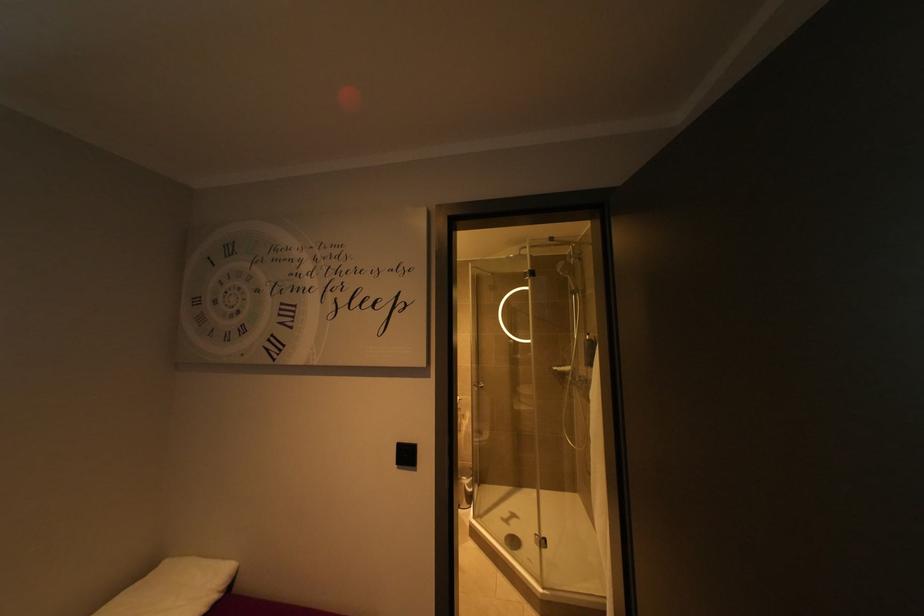
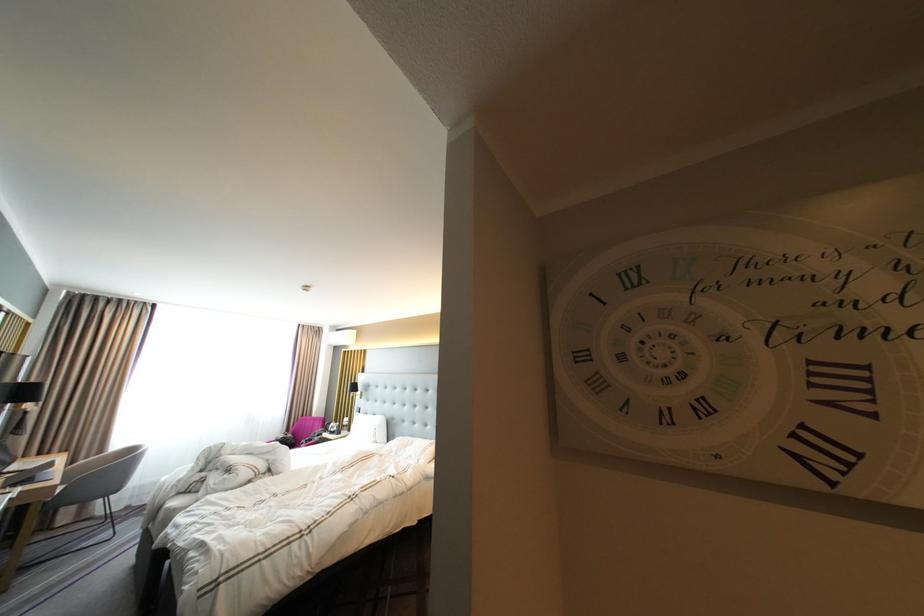
Question: In a continuous first-person perspective shot, in which direction is the camera moving?

Choices:
 (A) Left
 (B) Right
 (C) Forward
 (D) Backward

Answer: (A)